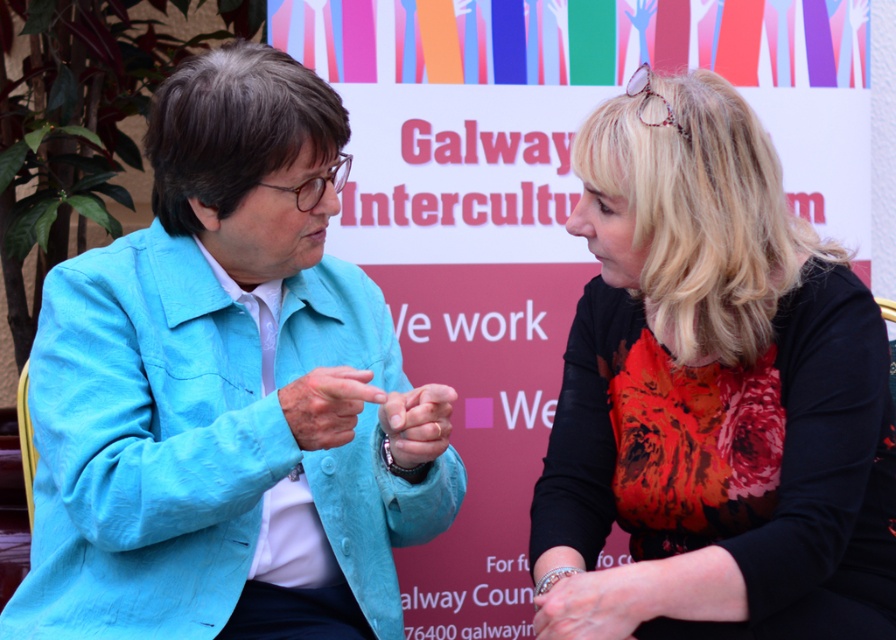
Question: Is floral print blouse at center above silver metallic bracelet at lower center?

Choices:
 (A) yes
 (B) no

Answer: (A)

Question: Considering the real-world distances, which object is closest to the floral print blouse at center?

Choices:
 (A) matte blue jacket at center
 (B) silver metallic bracelet at lower center
 (C) matte blue hand at center

Answer: (B)

Question: Does floral print blouse at center have a lesser width compared to silver metallic bracelet at lower center?

Choices:
 (A) no
 (B) yes

Answer: (A)

Question: Which of these objects is positioned farthest from the silver metallic bracelet at lower center?

Choices:
 (A) matte blue finger at center
 (B) floral print blouse at center
 (C) matte blue hand at center
 (D) matte blue jacket at center

Answer: (D)

Question: Is matte blue jacket at center wider than silver metallic bracelet at lower center?

Choices:
 (A) no
 (B) yes

Answer: (B)

Question: Which point is farther to the camera?

Choices:
 (A) matte blue finger at center
 (B) floral print blouse at center
 (C) silver metallic bracelet at lower center

Answer: (A)